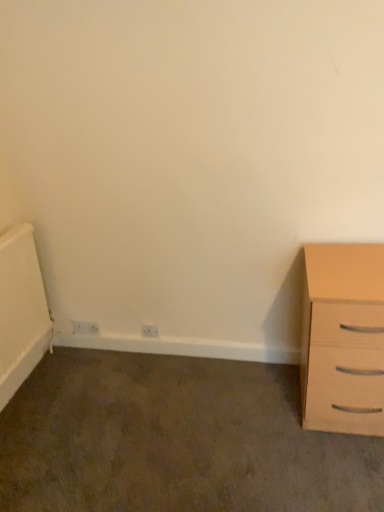
Describe the element at coordinates (85, 327) in the screenshot. I see `white plastic electric outlet at lower left, the 2th electric outlet in the front-to-back sequence` at that location.

What do you see at coordinates (343, 338) in the screenshot? The image size is (384, 512). I see `light wood chest of drawers at right` at bounding box center [343, 338].

This screenshot has height=512, width=384. I want to click on white plastic electric outlet at lower center, arranged as the first electric outlet when viewed from the front, so click(150, 330).

At what (x,y) coordinates should I click in order to perform the action: click on white plastic electric outlet at lower left, which ranks as the first electric outlet in left-to-right order. Please return your answer as a coordinate pair (x, y). This screenshot has width=384, height=512. Looking at the image, I should click on (85, 327).

In the image, is white plastic electric outlet at lower center, arranged as the first electric outlet when viewed from the front, positioned in front of or behind light wood chest of drawers at right?

white plastic electric outlet at lower center, arranged as the first electric outlet when viewed from the front, is behind light wood chest of drawers at right.

From a real-world perspective, is white plastic electric outlet at lower center, arranged as the first electric outlet when viewed from the front, positioned under light wood chest of drawers at right based on gravity?

Yes, from a real-world perspective, white plastic electric outlet at lower center, arranged as the first electric outlet when viewed from the front, is below light wood chest of drawers at right.

Considering the sizes of white plastic electric outlet at lower center, arranged as the first electric outlet when viewed from the front, and light wood chest of drawers at right in the image, is white plastic electric outlet at lower center, arranged as the first electric outlet when viewed from the front, wider or thinner than light wood chest of drawers at right?

Considering their sizes, white plastic electric outlet at lower center, arranged as the first electric outlet when viewed from the front, looks slimmer than light wood chest of drawers at right.

From the image's perspective, who appears lower, white plastic electric outlet at lower center, arranged as the first electric outlet when viewed from the front, or white plastic electric outlet at lower left, which is the first electric outlet in back-to-front order?

white plastic electric outlet at lower center, arranged as the first electric outlet when viewed from the front, appears lower in the image.

Which is in front, point (146, 324) or point (92, 331)?

The point (146, 324) is closer to the camera.

How different are the orientations of white plastic electric outlet at lower center, which appears as the second electric outlet when viewed from the back, and white plastic electric outlet at lower left, which ranks as the first electric outlet in left-to-right order, in degrees?

1.22 degrees separate the facing orientations of white plastic electric outlet at lower center, which appears as the second electric outlet when viewed from the back, and white plastic electric outlet at lower left, which ranks as the first electric outlet in left-to-right order.

Measure the distance from light wood chest of drawers at right to white plastic electric outlet at lower center, arranged as the first electric outlet when viewed from the front.

They are 3.32 feet apart.

From the image's perspective, who appears lower, light wood chest of drawers at right or white plastic electric outlet at lower center, which is counted as the 2th electric outlet, starting from the left?

white plastic electric outlet at lower center, which is counted as the 2th electric outlet, starting from the left.

Is light wood chest of drawers at right further to camera compared to white plastic electric outlet at lower center, which appears as the second electric outlet when viewed from the back?

That is False.

Does light wood chest of drawers at right turn towards white plastic electric outlet at lower left, which ranks as the first electric outlet in left-to-right order?

No, light wood chest of drawers at right is not aimed at white plastic electric outlet at lower left, which ranks as the first electric outlet in left-to-right order.

From the image's perspective, is light wood chest of drawers at right located above or below white plastic electric outlet at lower left, which is the first electric outlet in back-to-front order?

Based on their image positions, light wood chest of drawers at right is located above white plastic electric outlet at lower left, which is the first electric outlet in back-to-front order.

Which of these two, light wood chest of drawers at right or white plastic electric outlet at lower left, which ranks as the first electric outlet in left-to-right order, is thinner?

white plastic electric outlet at lower left, which ranks as the first electric outlet in left-to-right order.

How far apart are light wood chest of drawers at right and white plastic electric outlet at lower left, the 2th electric outlet in the front-to-back sequence?

A distance of 4.27 feet exists between light wood chest of drawers at right and white plastic electric outlet at lower left, the 2th electric outlet in the front-to-back sequence.

Is point (79, 330) more distant than point (351, 336)?

Yes, it is behind point (351, 336).

From a real-world perspective, is white plastic electric outlet at lower left, which ranks as the first electric outlet in left-to-right order, positioned under light wood chest of drawers at right based on gravity?

Correct, in the physical world, white plastic electric outlet at lower left, which ranks as the first electric outlet in left-to-right order, is lower than light wood chest of drawers at right.

Where is `electric outlet that is the 2nd one below the light wood chest of drawers at right (from a real-world perspective)`? electric outlet that is the 2nd one below the light wood chest of drawers at right (from a real-world perspective) is located at coordinates (85, 327).

Are white plastic electric outlet at lower left, which ranks as the 2th electric outlet in right-to-left order, and light wood chest of drawers at right beside each other?

No.

In the scene shown: Is white plastic electric outlet at lower left, which is the first electric outlet in back-to-front order, oriented away from white plastic electric outlet at lower center, which appears as the second electric outlet when viewed from the back?

No.

Is point (98, 330) positioned behind point (156, 331)?

Yes.

From the image's perspective, is white plastic electric outlet at lower left, the 2th electric outlet in the front-to-back sequence, above white plastic electric outlet at lower center, which is counted as the 2th electric outlet, starting from the left?

Yes, from the image's perspective, white plastic electric outlet at lower left, the 2th electric outlet in the front-to-back sequence, is on top of white plastic electric outlet at lower center, which is counted as the 2th electric outlet, starting from the left.

At what (x,y) coordinates should I click in order to perform the action: click on the chest of drawers located in front of the white plastic electric outlet at lower center, which appears as the second electric outlet when viewed from the back. Please return your answer as a coordinate pair (x, y). Looking at the image, I should click on (343, 338).

Where is `electric outlet below the white plastic electric outlet at lower left, which is the first electric outlet in back-to-front order (from the image's perspective)`? electric outlet below the white plastic electric outlet at lower left, which is the first electric outlet in back-to-front order (from the image's perspective) is located at coordinates (150, 330).

When comparing their distances from light wood chest of drawers at right, does white plastic electric outlet at lower left, which is the first electric outlet in back-to-front order, or white plastic electric outlet at lower center, arranged as the first electric outlet when viewed from the front, seem closer?

white plastic electric outlet at lower center, arranged as the first electric outlet when viewed from the front, lies closer to light wood chest of drawers at right than the other object.

When comparing their distances from light wood chest of drawers at right, does white plastic electric outlet at lower center, which appears as the second electric outlet when viewed from the back, or white plastic electric outlet at lower left, which is the first electric outlet in back-to-front order, seem closer?

white plastic electric outlet at lower center, which appears as the second electric outlet when viewed from the back.

Looking at the image, which one is located further to white plastic electric outlet at lower left, the 2th electric outlet in the front-to-back sequence, light wood chest of drawers at right or white plastic electric outlet at lower center, which appears as the second electric outlet when viewed from the back?

Among the two, light wood chest of drawers at right is located further to white plastic electric outlet at lower left, the 2th electric outlet in the front-to-back sequence.

When comparing their distances from white plastic electric outlet at lower left, the 2th electric outlet in the front-to-back sequence, does white plastic electric outlet at lower center, which is counted as the 2th electric outlet, starting from the left, or light wood chest of drawers at right seem closer?

The object closer to white plastic electric outlet at lower left, the 2th electric outlet in the front-to-back sequence, is white plastic electric outlet at lower center, which is counted as the 2th electric outlet, starting from the left.

Looking at the image, which one is located closer to white plastic electric outlet at lower center, which appears as the second electric outlet when viewed from the back, light wood chest of drawers at right or white plastic electric outlet at lower left, which is the first electric outlet in back-to-front order?

white plastic electric outlet at lower left, which is the first electric outlet in back-to-front order.

Estimate the real-world distances between objects in this image. Which object is closer to white plastic electric outlet at lower center, which is counted as the 2th electric outlet, starting from the left, white plastic electric outlet at lower left, which is the first electric outlet in back-to-front order, or light wood chest of drawers at right?

white plastic electric outlet at lower left, which is the first electric outlet in back-to-front order, is positioned closer to the anchor white plastic electric outlet at lower center, which is counted as the 2th electric outlet, starting from the left.

At what (x,y) coordinates should I click in order to perform the action: click on electric outlet between white plastic electric outlet at lower left, which ranks as the first electric outlet in left-to-right order, and light wood chest of drawers at right, in the horizontal direction. Please return your answer as a coordinate pair (x, y). This screenshot has width=384, height=512. Looking at the image, I should click on (150, 330).